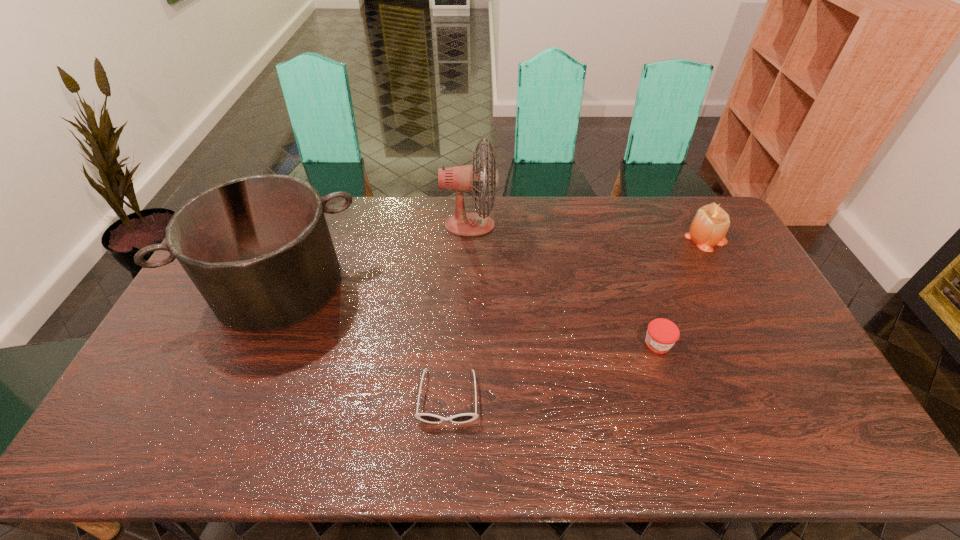
Identify the location of fan. (465, 178).

Identify the location of pan. The image size is (960, 540). (258, 248).

You are a GUI agent. You are given a task and a screenshot of the screen. Output one action in this format:
    pyautogui.click(x=<x>, y=<y>)
    Task: Click on the leftmost object
    This screenshot has width=960, height=540.
    Given the screenshot: What is the action you would take?
    pyautogui.click(x=258, y=248)

Find the location of a particular element. The width and height of the screenshot is (960, 540). candle is located at coordinates (711, 222).

I want to click on the third tallest object, so click(711, 222).

Locate an element on the screen. This screenshot has height=540, width=960. the fourth object from left to right is located at coordinates (662, 334).

Identify the location of jam. (662, 334).

Find the location of a particular element. The height and width of the screenshot is (540, 960). sunglasses is located at coordinates (425, 417).

Where is `the shortest object`? the shortest object is located at coordinates (425, 417).

Locate an element on the screen. vacant area situated in front of the fan to direct airflow is located at coordinates (516, 225).